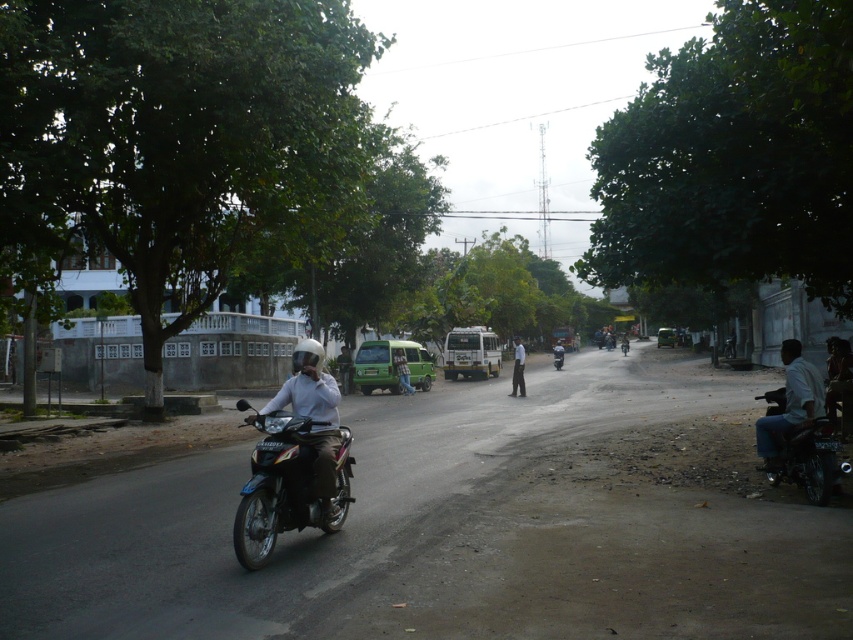
Question: Is shiny black motorcycle at center-left behind matte white helmet at center?

Choices:
 (A) yes
 (B) no

Answer: (B)

Question: Among these points, which one is nearest to the camera?

Choices:
 (A) (757, 426)
 (B) (560, 348)

Answer: (A)

Question: Which point is farther to the camera?

Choices:
 (A) (265, 451)
 (B) (793, 404)
 (C) (294, 348)

Answer: (C)

Question: Can you confirm if dark blue jeans at right is positioned above white matte shirt at center?

Choices:
 (A) no
 (B) yes

Answer: (A)

Question: Is the position of matte white helmet at center more distant than that of dark blue jeans at right?

Choices:
 (A) no
 (B) yes

Answer: (A)

Question: Which of the following is the farthest from the observer?

Choices:
 (A) (334, 432)
 (B) (560, 358)

Answer: (B)